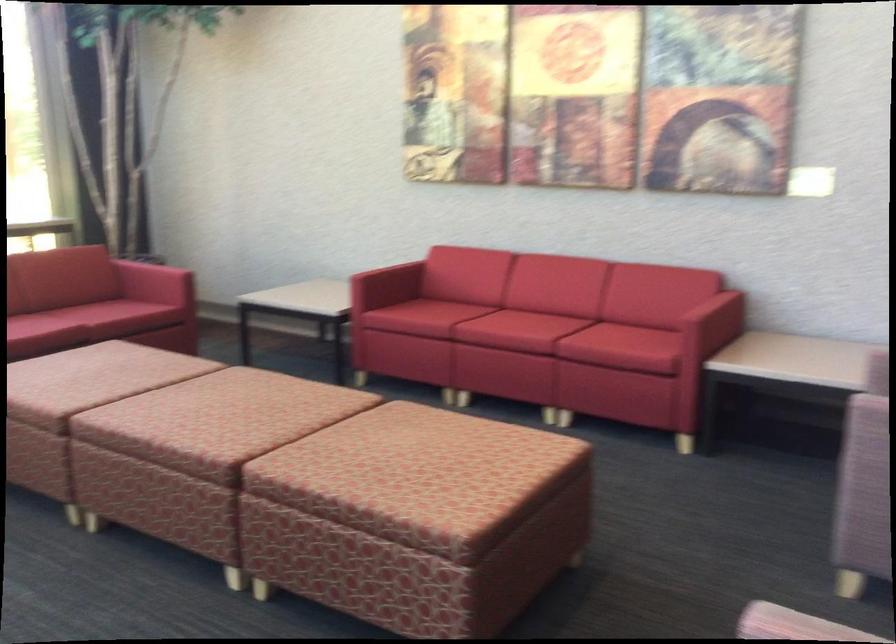
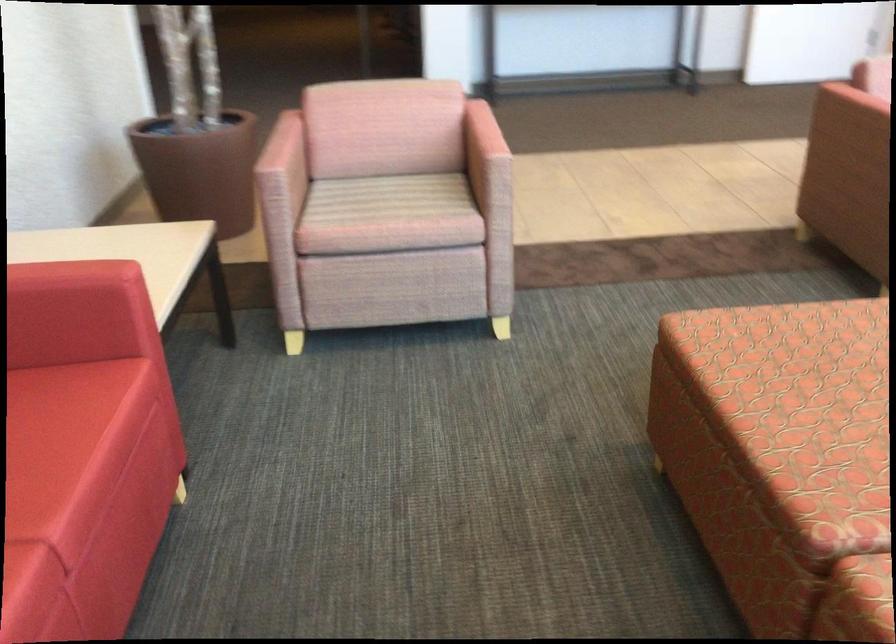
Find the pixel in the second image that matches point (513, 447) in the first image.

(782, 350)